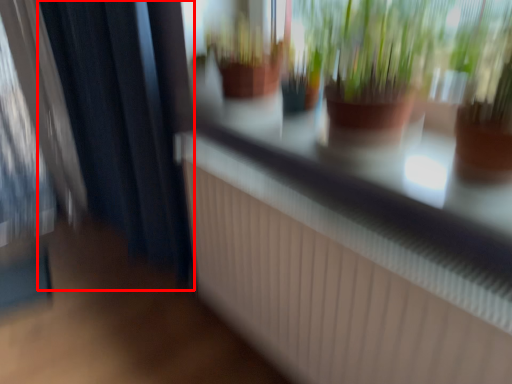
Question: From the image's perspective, where is curtain (annotated by the red box) located in relation to shop window in the image?

Choices:
 (A) above
 (B) below

Answer: (A)